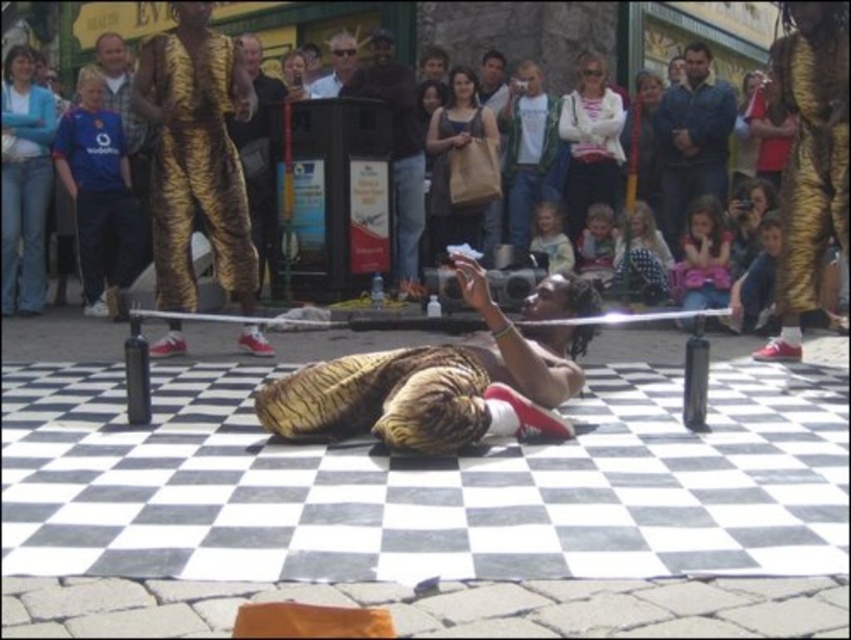
You are a photographer trying to capture the street performance. You want to position yourself so that the white sweater at center and the matte gold costume at upper center are both visible in your frame. Based on their positions, which object should you place closer to the left side of your camera view?

The white sweater at center is to the left of the matte gold costume at upper center, so you should place the white sweater at center closer to the left side of your camera view.

You are a photographer standing at the edge of the checkered mat. You want to take a photo that includes both the white sweater at center and the matte gold costume at upper center. Given that your camera has a maximum focus range of 3 feet, will you be able to capture both objects clearly in the same frame?

The white sweater at center and matte gold costume at upper center are 3.38 feet apart, which exceeds the camera maximum focus range of 3 feet. Therefore, you cannot capture both objects clearly in the same frame.

You are a spectator standing at the edge of the checkered mat observing the street performance. There are two points marked on the mat at coordinates point (220,97) and point (644,193). Which of these points is closer to you?

Point (220,97) is closer to the viewer than point (644,193).